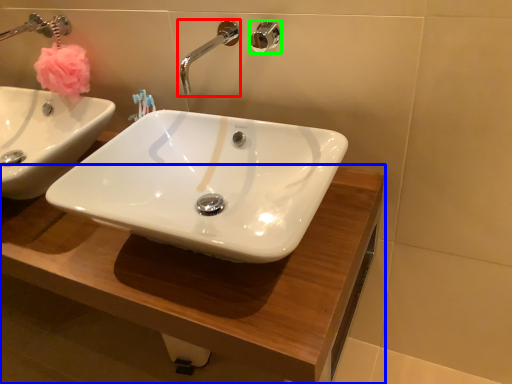
Question: Estimate the real-world distances between objects in this image. Which object is farther from tap (highlighted by a red box), counter top (highlighted by a blue box) or shower (highlighted by a green box)?

Choices:
 (A) counter top
 (B) shower

Answer: (A)